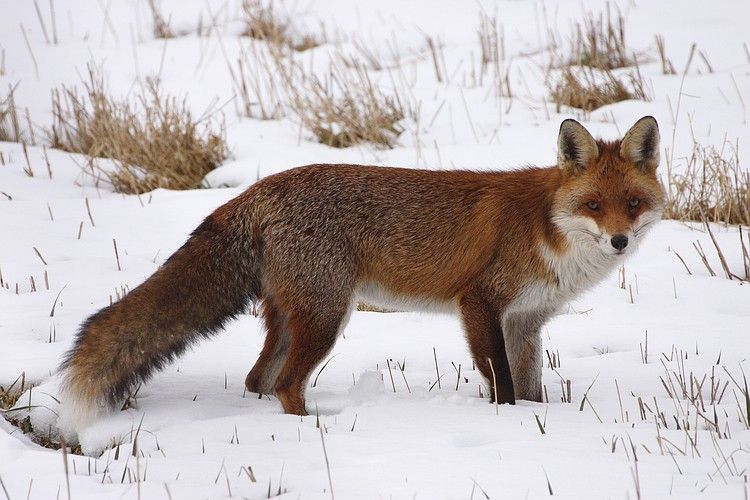
At what (x,y) coordinates should I click in order to perform the action: click on left front leg. Please return your answer as a coordinate pair (x, y). The width and height of the screenshot is (750, 500). Looking at the image, I should click on (526, 350).